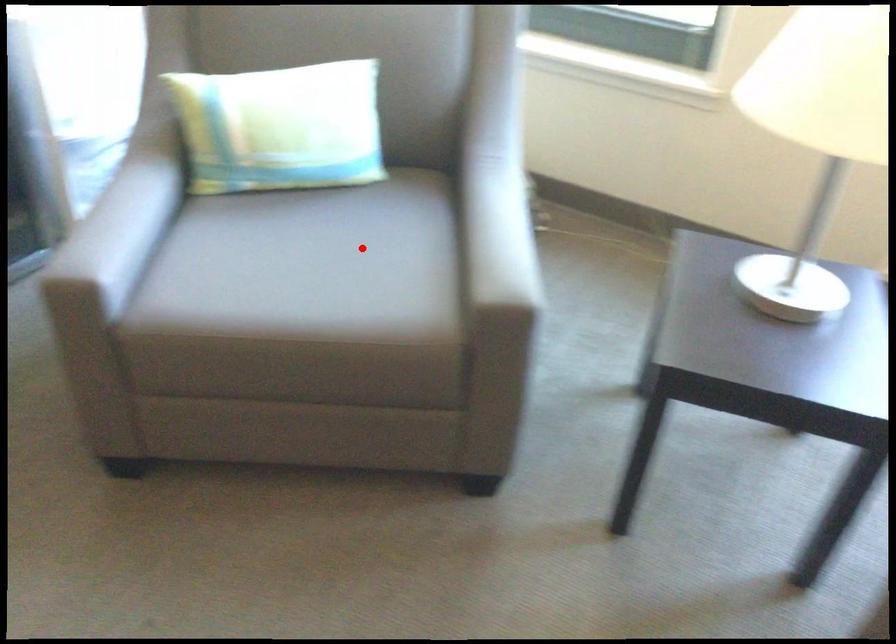
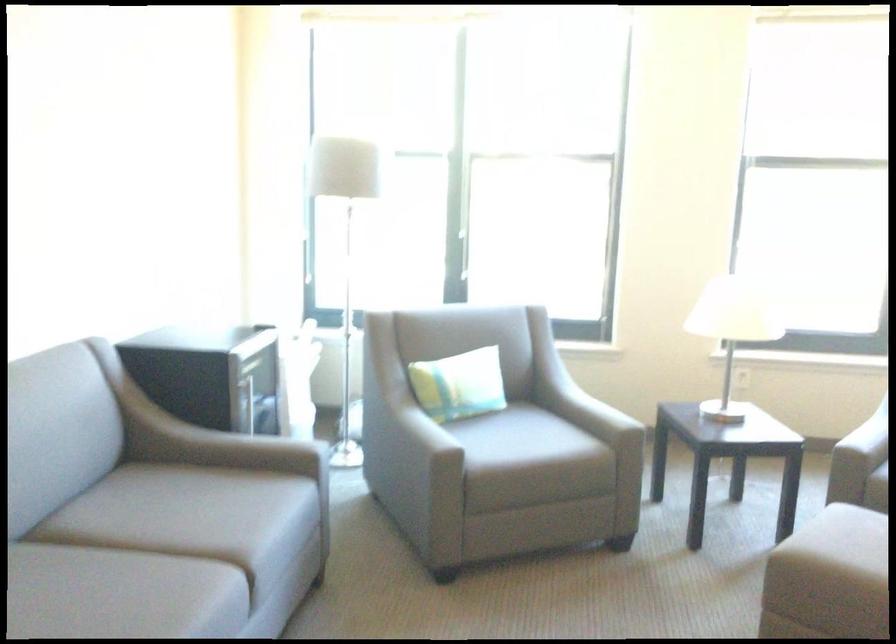
Question: I am providing you with two images of the same scene from different viewpoints. Given a red point in image1, look at the same physical point in image2. Is it:

Choices:
 (A) Closer to the viewpoint
 (B) Farther from the viewpoint

Answer: (B)